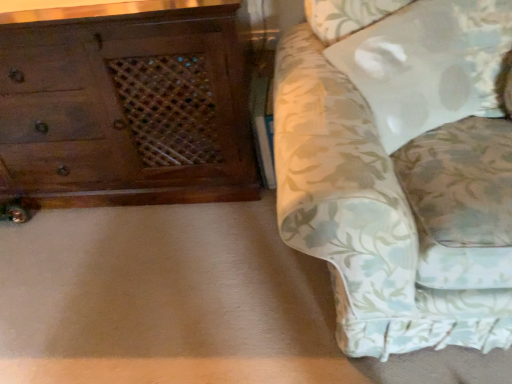
Locate an element on the screen. Image resolution: width=512 pixels, height=384 pixels. free space in front of wooden chest of drawers at left is located at coordinates (121, 274).